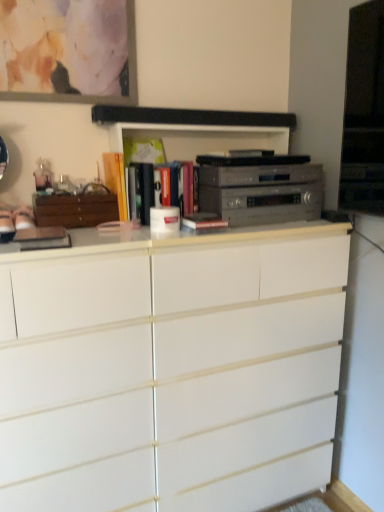
Question: From the image's perspective, does matte glass picture frame at upper left appear higher than matte yellow book at center, marked as the 2th book in a left-to-right arrangement?

Choices:
 (A) yes
 (B) no

Answer: (A)

Question: Is matte glass picture frame at upper left further to camera compared to matte yellow book at center, marked as the 2th book in a left-to-right arrangement?

Choices:
 (A) no
 (B) yes

Answer: (A)

Question: Can you confirm if matte glass picture frame at upper left is wider than matte yellow book at center, which ranks as the third book in right-to-left order?

Choices:
 (A) no
 (B) yes

Answer: (A)

Question: Is matte glass picture frame at upper left placed right next to matte yellow book at center, marked as the 2th book in a left-to-right arrangement?

Choices:
 (A) no
 (B) yes

Answer: (A)

Question: Is matte glass picture frame at upper left thinner than matte yellow book at center, marked as the 2th book in a left-to-right arrangement?

Choices:
 (A) no
 (B) yes

Answer: (B)

Question: Would you say wooden cabinet at left is inside or outside hardcover book at center, which is the 1th book from right to left?

Choices:
 (A) outside
 (B) inside

Answer: (A)

Question: Considering the positions of point (91, 203) and point (213, 226), is point (91, 203) closer or farther from the camera than point (213, 226)?

Choices:
 (A) farther
 (B) closer

Answer: (A)

Question: Considering the positions of wooden cabinet at left and hardcover book at center, positioned as the 4th book in left-to-right order, in the image, is wooden cabinet at left taller or shorter than hardcover book at center, positioned as the 4th book in left-to-right order,?

Choices:
 (A) tall
 (B) short

Answer: (A)

Question: Considering the positions of wooden cabinet at left and hardcover book at center, positioned as the 4th book in left-to-right order, in the image, is wooden cabinet at left bigger or smaller than hardcover book at center, positioned as the 4th book in left-to-right order,?

Choices:
 (A) big
 (B) small

Answer: (A)

Question: Do you think white matte chest of drawers at center is within matte glass picture frame at upper left, or outside of it?

Choices:
 (A) inside
 (B) outside

Answer: (B)

Question: Is point (309, 280) positioned closer to the camera than point (31, 37)?

Choices:
 (A) farther
 (B) closer

Answer: (A)

Question: In terms of height, does white matte chest of drawers at center look taller or shorter compared to matte glass picture frame at upper left?

Choices:
 (A) tall
 (B) short

Answer: (A)

Question: Is white matte chest of drawers at center in front of or behind matte glass picture frame at upper left in the image?

Choices:
 (A) behind
 (B) front

Answer: (B)

Question: Considering their positions, is hardcover book at center, which is the 2th book from right to left, located in front of or behind matte orange book at center, the fourth book positioned from the right?

Choices:
 (A) front
 (B) behind

Answer: (A)

Question: Is hardcover book at center, which is the third book from left to right, bigger or smaller than matte orange book at center, the fourth book positioned from the right?

Choices:
 (A) small
 (B) big

Answer: (B)